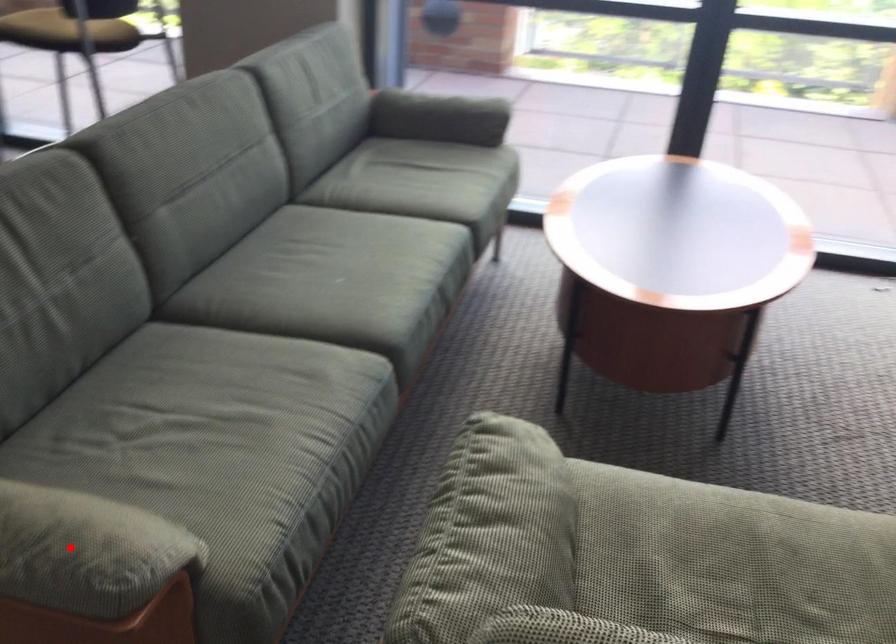
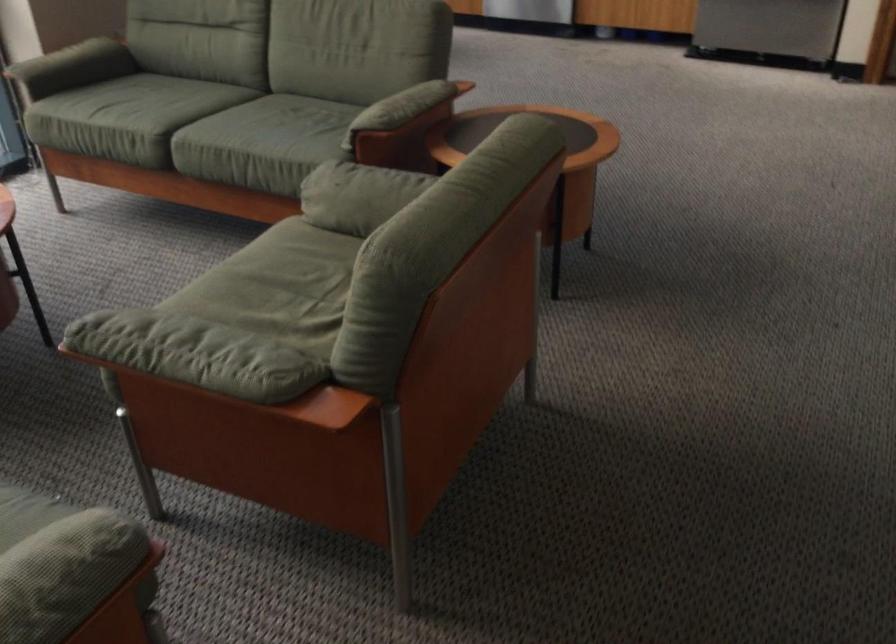
In the second image, find the point that corresponds to the highlighted location in the first image.

(71, 559)